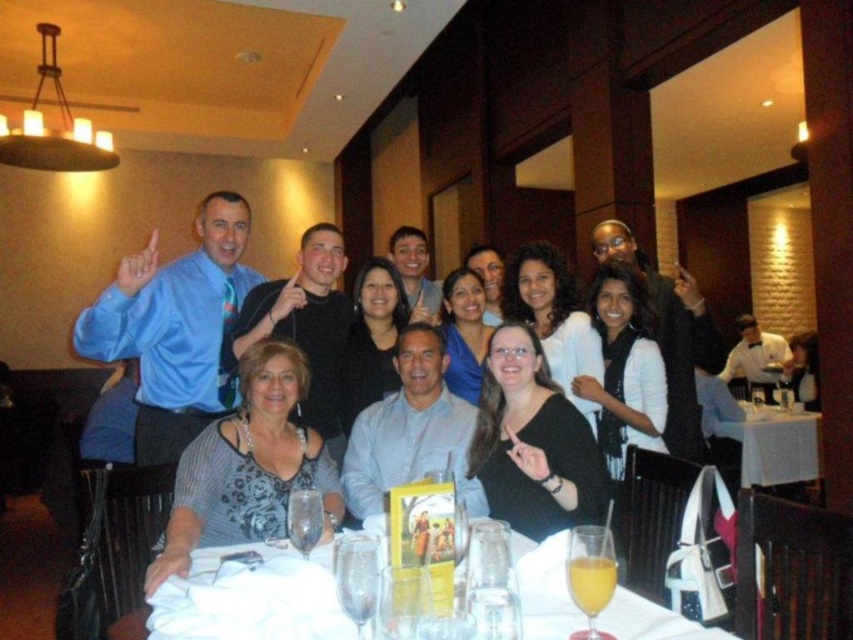
Question: Which of these objects is positioned farthest from the striped fabric dress at center?

Choices:
 (A) white paper napkin at lower center
 (B) white tablecloth at center

Answer: (B)

Question: Does black matte shirt at center appear on the right side of white tablecloth at center?

Choices:
 (A) yes
 (B) no

Answer: (B)

Question: Which of the following is the farthest from the observer?

Choices:
 (A) white tablecloth at center
 (B) striped fabric dress at center
 (C) black matte shirt at center

Answer: (A)

Question: Can you confirm if white paper napkin at lower center is bigger than striped fabric dress at center?

Choices:
 (A) yes
 (B) no

Answer: (B)

Question: Considering the real-world distances, which object is farthest from the white paper napkin at lower center?

Choices:
 (A) black matte shirt at center
 (B) white tablecloth at center

Answer: (B)

Question: Does striped fabric dress at center appear on the right side of white tablecloth at center?

Choices:
 (A) yes
 (B) no

Answer: (B)